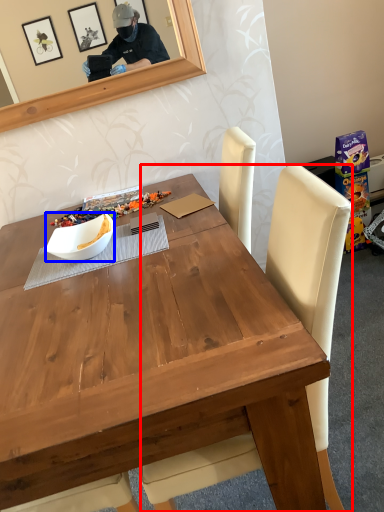
Question: Which point is further to the camera, chair (highlighted by a red box) or bowl (highlighted by a blue box)?

Choices:
 (A) chair
 (B) bowl

Answer: (B)